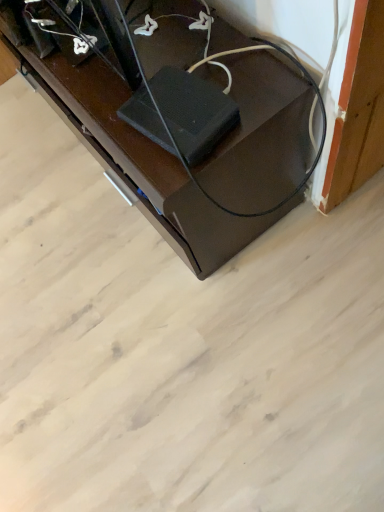
The height and width of the screenshot is (512, 384). What are the coordinates of `free spot to the right of black rubber speaker at center` in the screenshot? It's located at (247, 77).